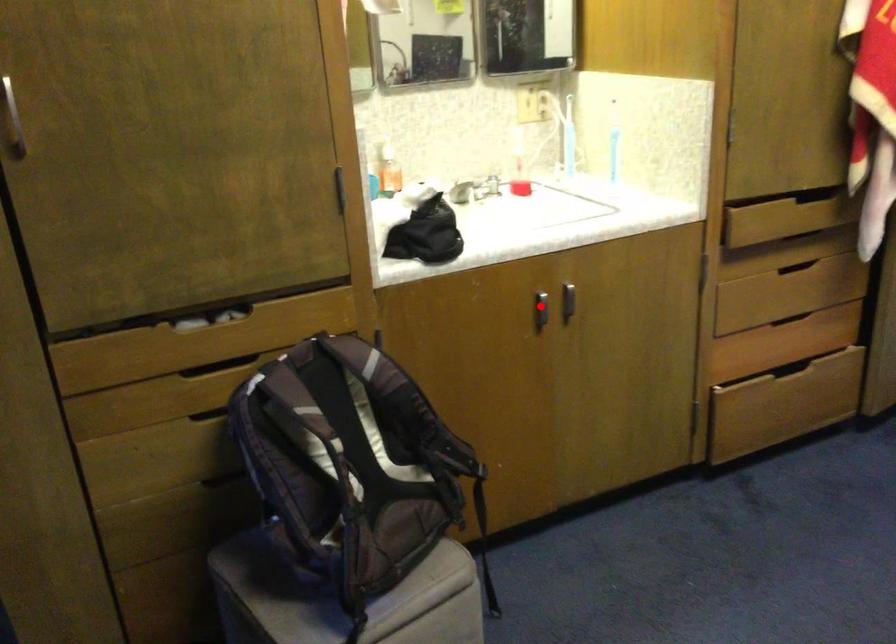
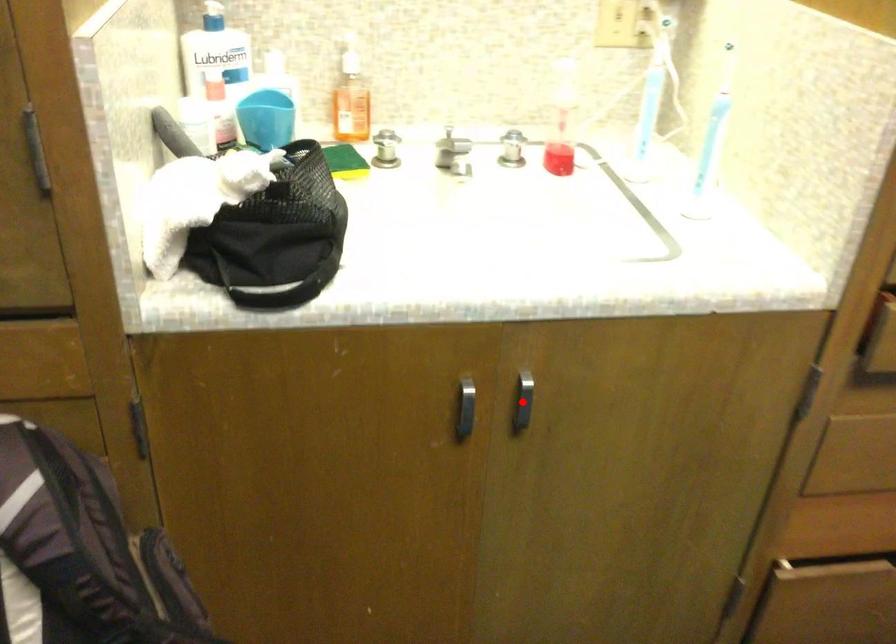
I am providing you with two images of the same scene from different viewpoints. A red point is marked on the first image and another point is marked on the second image. Is the red point in image1 aligned with the point shown in image2?

No